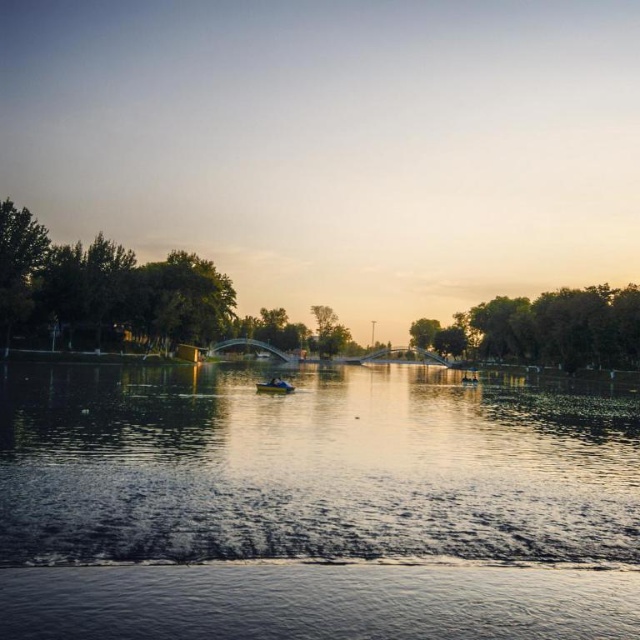
Does green leafy trees at right appear under green leafy tree at left?

Yes, green leafy trees at right is below green leafy tree at left.

Who is more distant from viewer, (506, 352) or (10, 202)?

The point (506, 352) is behind.

At what (x,y) coordinates should I click in order to perform the action: click on green leafy trees at right. Please return your answer as a coordinate pair (x, y). Looking at the image, I should click on (545, 328).

Who is positioned more to the right, reflective water surface at center or green leafy tree at left?

reflective water surface at center

Which is below, reflective water surface at center or green leafy tree at left?

Positioned lower is reflective water surface at center.

Which is in front, point (324, 444) or point (13, 220)?

Point (324, 444) is more forward.

In order to click on reflective water surface at center in this screenshot , I will do `click(304, 509)`.

Can you confirm if green leafy tree at center is bigger than metallic blue boat at center?

Yes.

Consider the image. Is green leafy tree at center above metallic blue boat at center?

Yes, green leafy tree at center is above metallic blue boat at center.

This screenshot has width=640, height=640. I want to click on green leafy tree at center, so click(x=422, y=332).